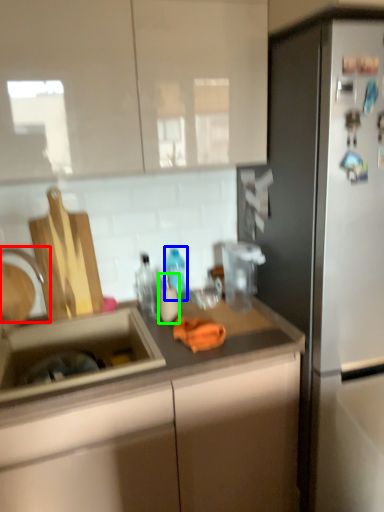
Question: Which object is positioned farthest from faucet (highlighted by a red box)? Select from bottle (highlighted by a blue box) and bottle (highlighted by a green box).

Choices:
 (A) bottle
 (B) bottle

Answer: (A)